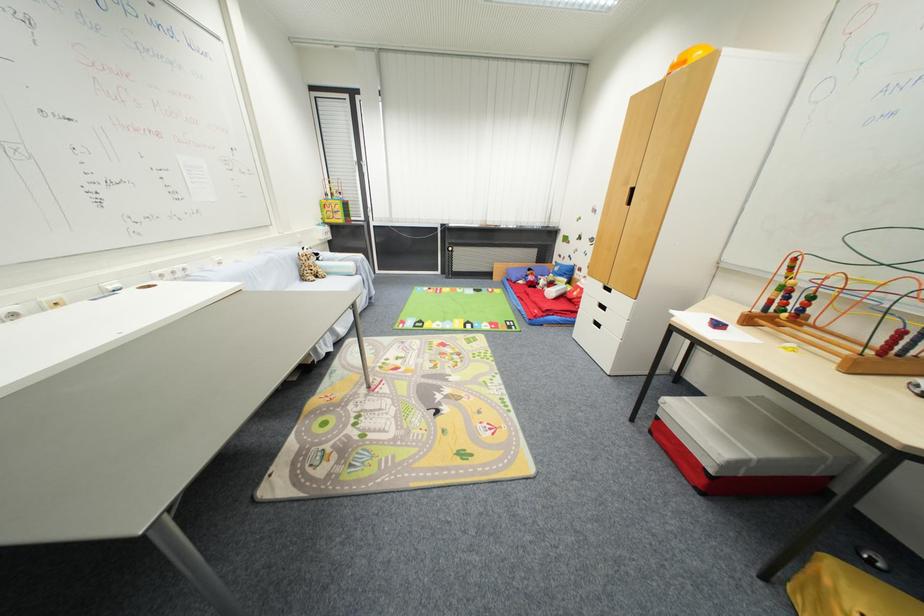
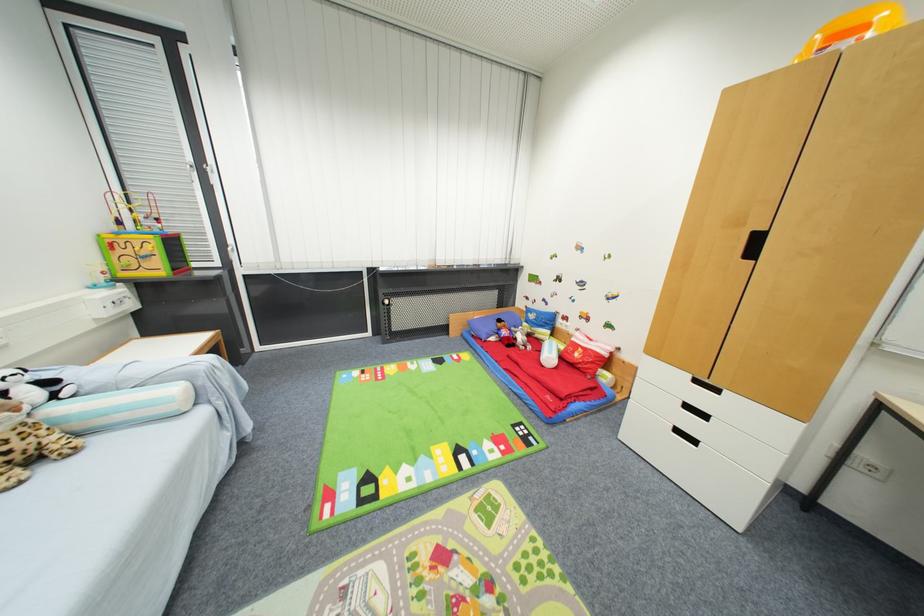
The point at (606, 286) is marked in the first image. Where is the corresponding point in the second image?

(695, 378)